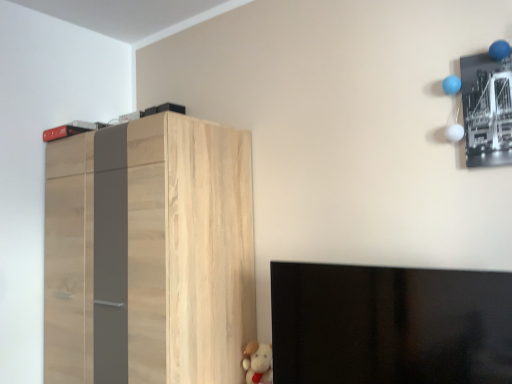
I want to click on black glossy tv at lower right, so click(389, 325).

This screenshot has width=512, height=384. What do you see at coordinates (389, 325) in the screenshot? I see `black glossy tv at lower right` at bounding box center [389, 325].

Measure the distance between point (319, 340) and camera.

The depth of point (319, 340) is 1.44 meters.

This screenshot has width=512, height=384. I want to click on black glossy tv at lower right, so click(389, 325).